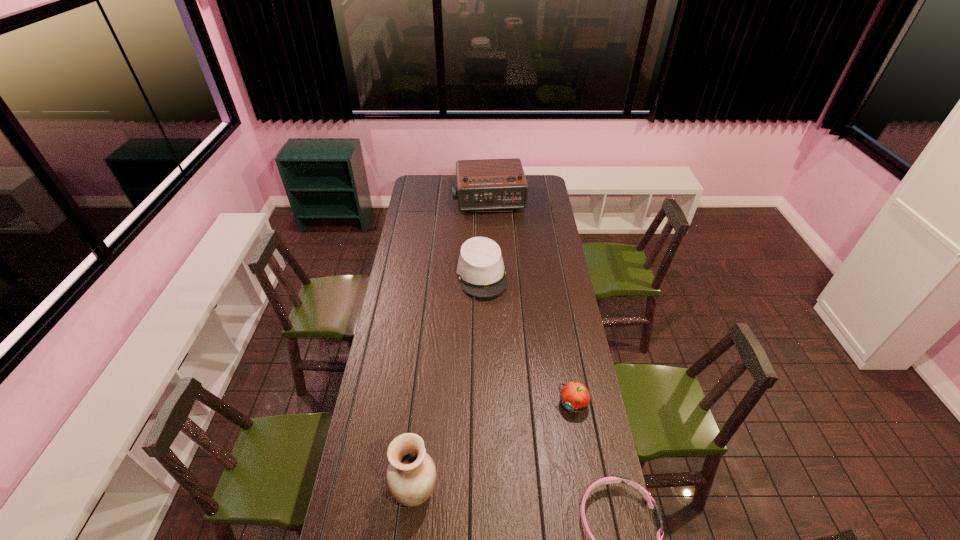
You are a GUI agent. You are given a task and a screenshot of the screen. Output one action in this format:
    pyautogui.click(x=<x>, y=<y>)
    Task: Click on the pottery
    The image size is (960, 540).
    Given the screenshot: What is the action you would take?
    pyautogui.click(x=411, y=474)

The width and height of the screenshot is (960, 540). In order to click on the fourth nearest object in this screenshot , I will do `click(481, 271)`.

This screenshot has width=960, height=540. I want to click on radio receiver, so click(488, 184).

You are a GUI agent. You are given a task and a screenshot of the screen. Output one action in this format:
    pyautogui.click(x=<x>, y=<y>)
    Task: Click on the farthest object
    The width and height of the screenshot is (960, 540).
    Given the screenshot: What is the action you would take?
    pyautogui.click(x=488, y=184)

Locate an element on the screen. The height and width of the screenshot is (540, 960). apple is located at coordinates (574, 396).

This screenshot has height=540, width=960. I want to click on free space located on the back of the tallest object, so [x=424, y=397].

Where is `vacant region located 0.100m on the front-facing side of the hat`? vacant region located 0.100m on the front-facing side of the hat is located at coordinates (490, 316).

Locate an element on the screen. The width and height of the screenshot is (960, 540). vacant area situated on the front-facing side of the hat is located at coordinates (498, 352).

Where is `vacant space located 0.140m on the front-facing side of the hat`? vacant space located 0.140m on the front-facing side of the hat is located at coordinates (492, 322).

The width and height of the screenshot is (960, 540). I want to click on vacant area located 0.370m on the tuning display of the farthest object, so click(x=498, y=256).